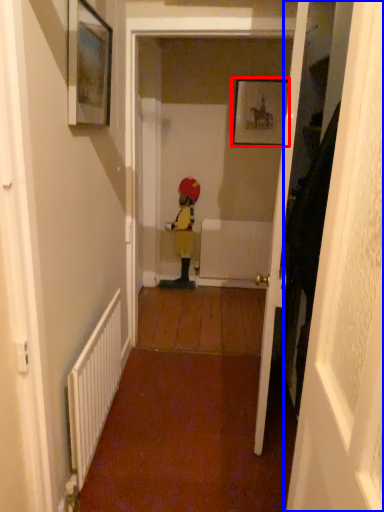
Question: Which object is closer to the camera taking this photo, picture frame (highlighted by a red box) or door (highlighted by a blue box)?

Choices:
 (A) picture frame
 (B) door

Answer: (B)